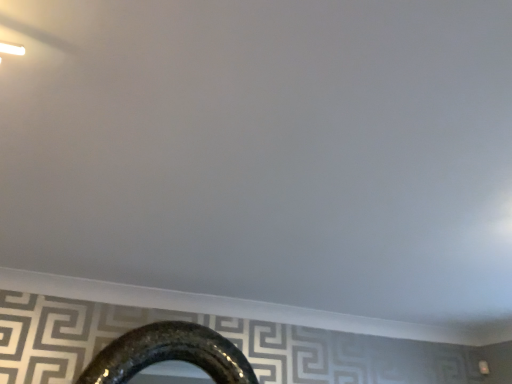
What is the approximate height of shiny black tire at lower center?

shiny black tire at lower center is 13.41 inches tall.

The width and height of the screenshot is (512, 384). What do you see at coordinates (169, 354) in the screenshot?
I see `shiny black tire at lower center` at bounding box center [169, 354].

Where is `shiny black tire at lower center`? Image resolution: width=512 pixels, height=384 pixels. shiny black tire at lower center is located at coordinates (169, 354).

Locate an element on the screen. Image resolution: width=512 pixels, height=384 pixels. shiny black tire at lower center is located at coordinates (169, 354).